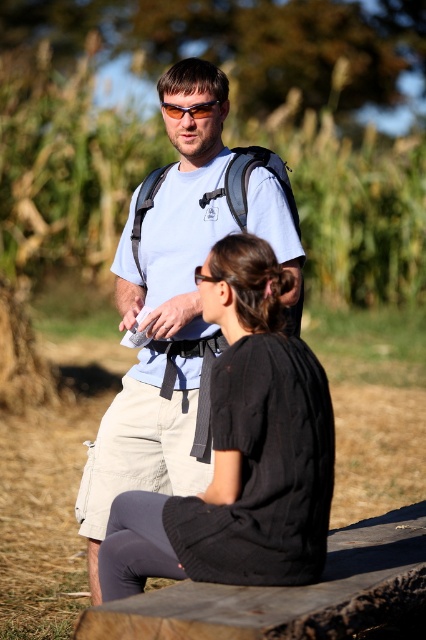
From the picture: You are standing at the point marked by the coordinates point (241, 451) in the image. Which object are you currently standing on?

The point (241, 451) is on the black textured sweater at center, so you are standing on the black textured sweater at center.

You are a photographer trying to capture a photo of both individuals in the scene. You notice two specific points marked as point 1 at coordinate (164,520) and point 2 at coordinate (192,109). Which point is closer to your camera lens so that you can focus on it first?

Point 1 at coordinate (164,520) is closer to the camera lens than point 2 at coordinate (192,109), so you should focus on point 1 first.